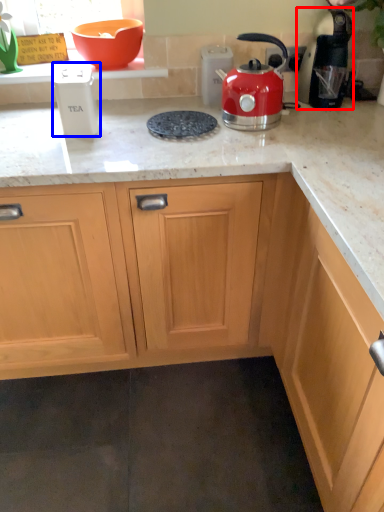
Question: Which of the following is the closest to the observer, kitchen appliance (highlighted by a red box) or kitchen appliance (highlighted by a blue box)?

Choices:
 (A) kitchen appliance
 (B) kitchen appliance

Answer: (B)